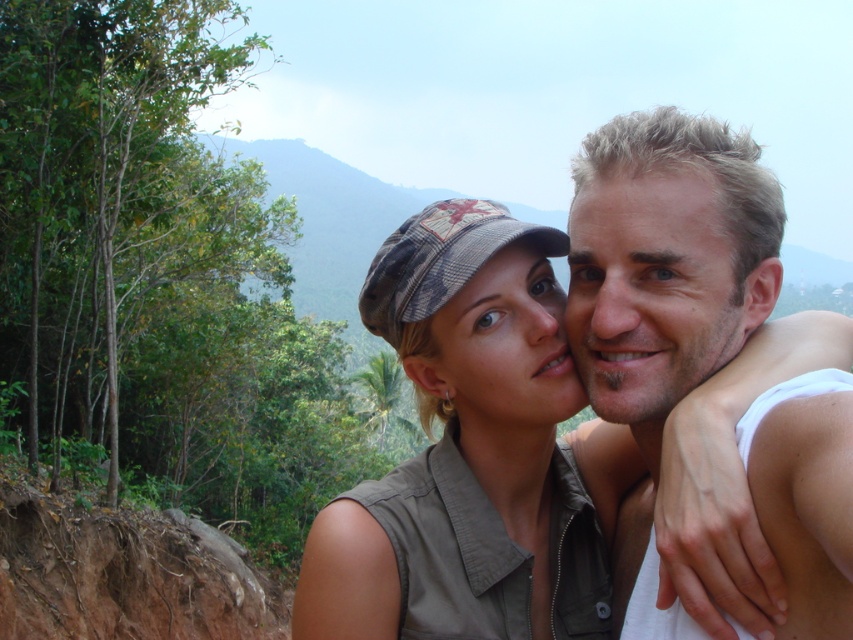
Which is above, smooth skin face at right or matte khaki cap at center?

smooth skin face at right

Does smooth skin face at right have a larger size compared to matte khaki cap at center?

Correct, smooth skin face at right is larger in size than matte khaki cap at center.

Is point (688, 256) closer to camera compared to point (509, 374)?

Yes, it is.

You are a GUI agent. You are given a task and a screenshot of the screen. Output one action in this format:
    pyautogui.click(x=<x>, y=<y>)
    Task: Click on the smooth skin face at right
    The width and height of the screenshot is (853, 640).
    Given the screenshot: What is the action you would take?
    pyautogui.click(x=653, y=291)

Is point (543, 572) positioned after point (786, 573)?

That is True.

Can you confirm if khaki fabric cap at center is positioned to the left of blonde hair at right?

Indeed, khaki fabric cap at center is positioned on the left side of blonde hair at right.

Is point (544, 355) behind point (822, 440)?

Yes.

Where is `khaki fabric cap at center`? This screenshot has width=853, height=640. khaki fabric cap at center is located at coordinates (485, 349).

How much distance is there between blonde hair at right and smooth skin face at right?

blonde hair at right is 1.88 inches from smooth skin face at right.

Between blonde hair at right and smooth skin face at right, which one is positioned lower?

Positioned lower is smooth skin face at right.

Which is in front, point (714, 308) or point (730, 253)?

Point (714, 308)

Where is `blonde hair at right`? The width and height of the screenshot is (853, 640). blonde hair at right is located at coordinates (666, 259).